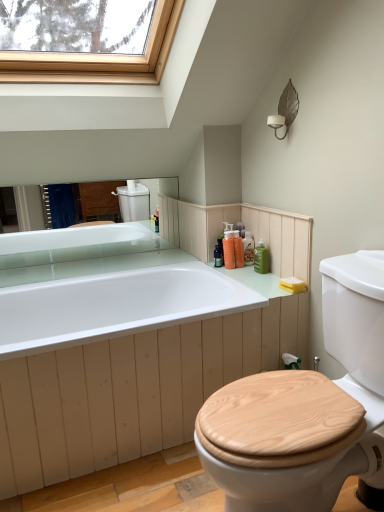
Locate an element on the screen. This screenshot has width=384, height=512. vacant space that's between yellow sponge at right and green plastic bottles at upper right, which ranks as the first toiletry in right-to-left order is located at coordinates (279, 278).